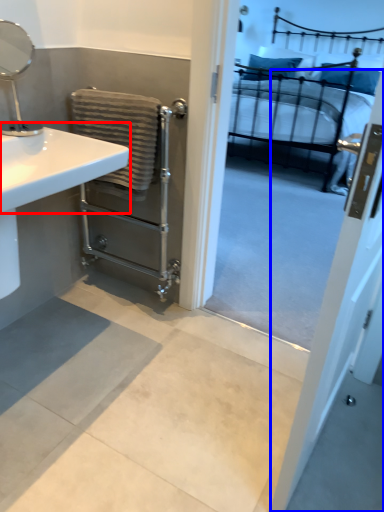
Question: Among these objects, which one is farthest to the camera, counter top (highlighted by a red box) or screen door (highlighted by a blue box)?

Choices:
 (A) counter top
 (B) screen door

Answer: (A)